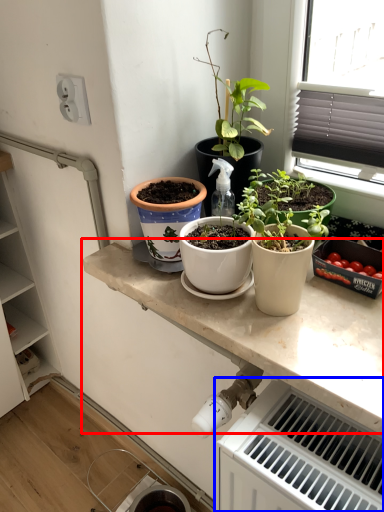
Question: Which of the following is the closest to the observer, countertop (highlighted by a red box) or radiator (highlighted by a blue box)?

Choices:
 (A) countertop
 (B) radiator

Answer: (B)